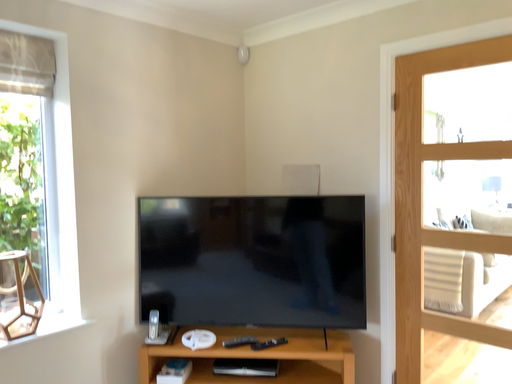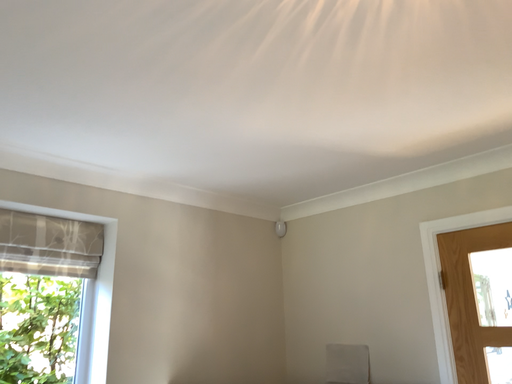
Question: How did the camera likely rotate when shooting the video?

Choices:
 (A) rotated upward
 (B) rotated downward

Answer: (A)